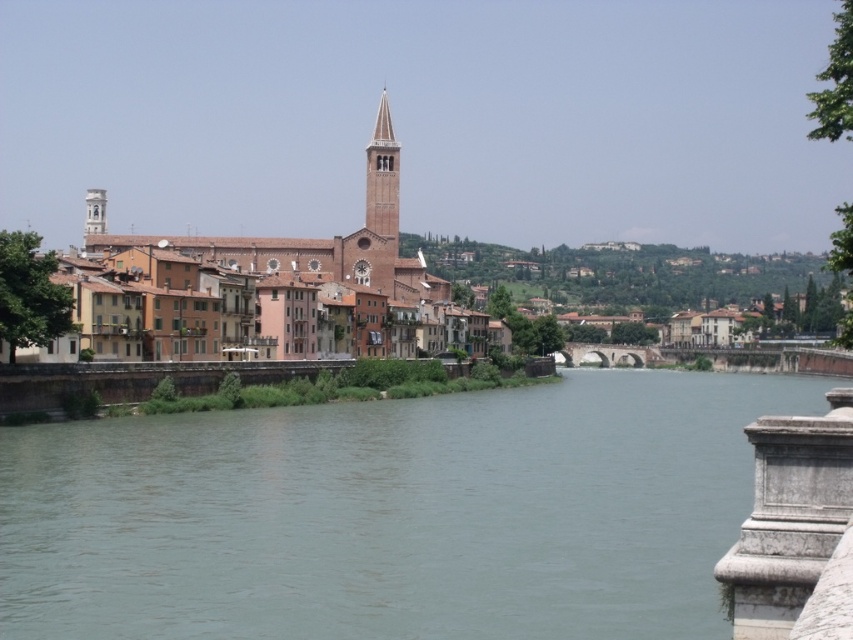
You are a tourist standing at the riverside and want to take a photo of the brown brick town at center. Where should you position yourself to capture the town in the center of your camera frame?

To capture the brown brick town at center in the center of your camera frame, position yourself directly in front of it at point 0.405 on the x axis and 0.349 on the y axis.

You are a tourist standing at the riverside and want to visit the brown brick town at center. According to the map, the town is located at point (297, 259). Can you determine the direction you should walk to reach it?

The brown brick town at center is located at point (297, 259), so you should walk towards the center of the image to reach it.

You are an architect analyzing the riverside scene. You need to determine which structure occupies more visual space in the image. Based on the scene, which is larger between the brown brick town at center and the smooth white tower at upper left?

The brown brick town at center is bigger than the smooth white tower at upper left, so it occupies more visual space in the image.